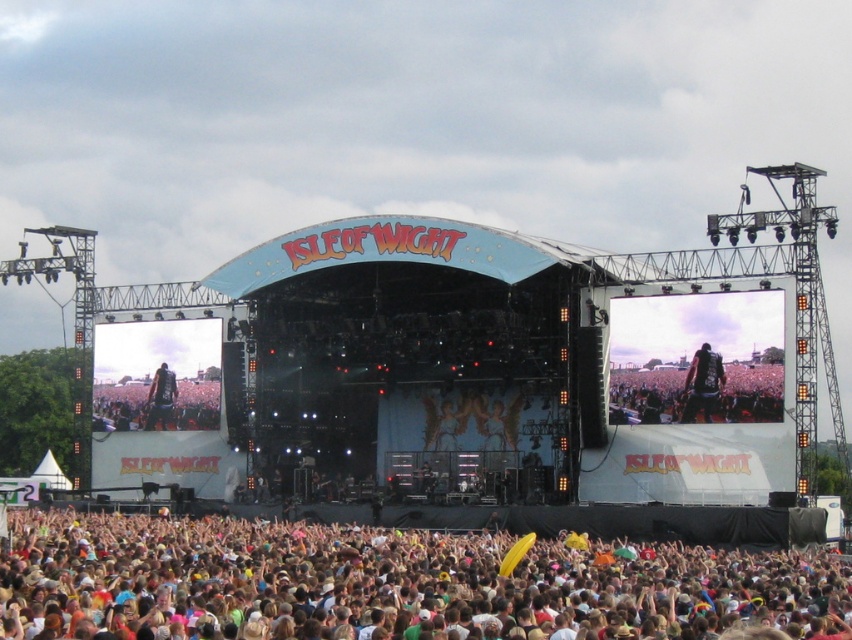
Question: Considering the real-world distances, which object is farthest from the dark blue fabric at center?

Choices:
 (A) dark brown leather jacket at center
 (B) multicolored fabric crowd at lower center

Answer: (A)

Question: Can you confirm if dark brown leather jacket at center is positioned above dark blue leather jacket at center?

Choices:
 (A) yes
 (B) no

Answer: (A)

Question: Among these objects, which one is nearest to the camera?

Choices:
 (A) multicolored fabric crowd at lower center
 (B) dark blue leather jacket at center
 (C) dark brown leather jacket at center

Answer: (A)

Question: Which point is closer to the camera taking this photo?

Choices:
 (A) (360, 544)
 (B) (135, 428)
 (C) (157, 390)
 (D) (694, 403)

Answer: (A)

Question: Is dark blue fabric at center closer to the viewer compared to dark blue leather jacket at center?

Choices:
 (A) no
 (B) yes

Answer: (B)

Question: Does dark blue fabric at center lie in front of dark brown leather jacket at center?

Choices:
 (A) yes
 (B) no

Answer: (B)